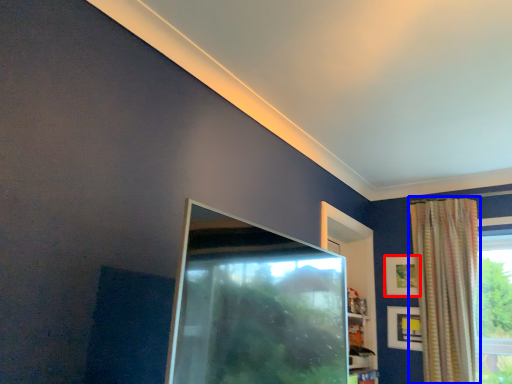
Question: Which of the following is the closest to the observer, picture frame (highlighted by a red box) or curtain (highlighted by a blue box)?

Choices:
 (A) picture frame
 (B) curtain

Answer: (B)